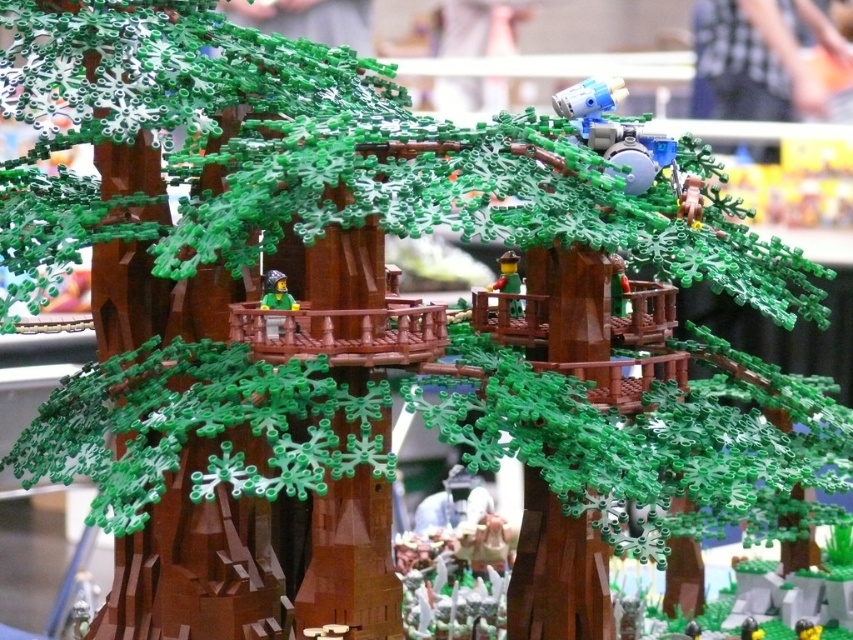
You are a LEGO figure trying to reach the smooth brown figure at center from the green matte minifigure at center. Which direction should you move to get closer?

The green matte minifigure at center is already closer to the viewer than the smooth brown figure at center, so to reach the smooth brown figure at center, you should move backward away from the viewer.

You are a LEGO figure trying to reach the smooth brown figure at center from the green matte minifigure at center. The maximum distance you can jump is 25 centimeters. Can you reach them in one jump?

The distance between the green matte minifigure at center and the smooth brown figure at center is 27.60 centimeters, which is greater than your maximum jump distance of 25 centimeters. Therefore, you cannot reach them in one jump.

You are a visitor looking at the LEGO treehouse scene. You notice a point marked at coordinates (276, 292). What is located at that point?

The point at coordinates (276, 292) indicates the green matte minifigure at center.